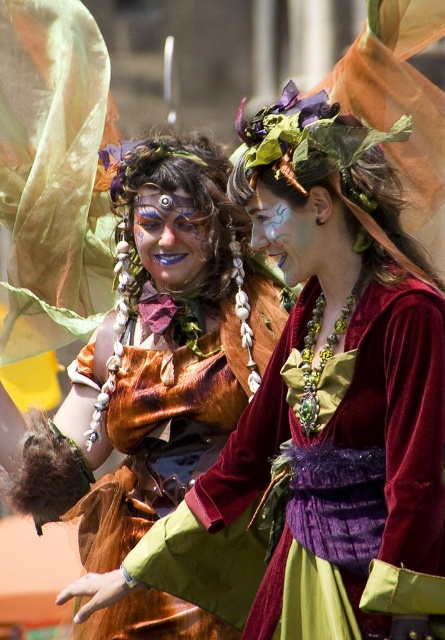
You are a photographer at the festival and want to capture both the velvet dress at center and the matte green face at center in a single frame. Which object should you focus on first to ensure both are in the shot?

The velvet dress at center is wider than the matte green face at center, so focusing on the velvet dress at center first will help ensure both fit within the frame.